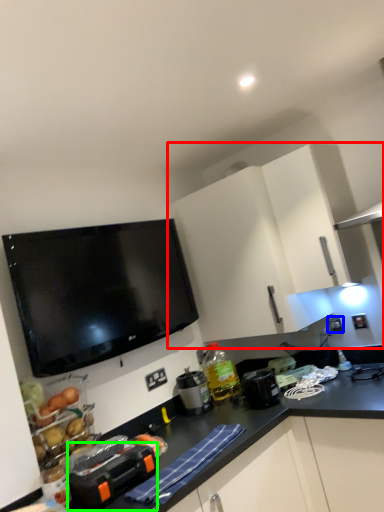
Question: Which object is positioned closest to cabinetry (highlighted by a red box)? Select from electric outlet (highlighted by a blue box) and appliance (highlighted by a green box).

Choices:
 (A) electric outlet
 (B) appliance

Answer: (A)